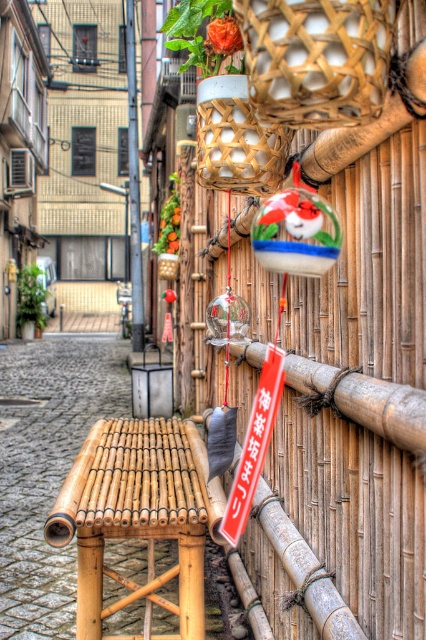
Does bamboo at center come behind natural bamboo stool at center?

That is False.

Which of these two, bamboo at center or natural bamboo stool at center, stands shorter?

natural bamboo stool at center is shorter.

Is point (307, 632) positioned in front of point (91, 556)?

Yes.

You are a GUI agent. You are given a task and a screenshot of the screen. Output one action in this format:
    pyautogui.click(x=<x>, y=<y>)
    Task: Click on the bamboo at center
    The image size is (426, 640).
    Given the screenshot: What is the action you would take?
    pyautogui.click(x=363, y=358)

From the picture: Can you confirm if bamboo woven basket at upper center is positioned to the left of red plastic sign at center?

Correct, you'll find bamboo woven basket at upper center to the left of red plastic sign at center.

The width and height of the screenshot is (426, 640). I want to click on bamboo woven basket at upper center, so click(x=316, y=58).

Identify the location of bamboo woven basket at center. (236, 140).